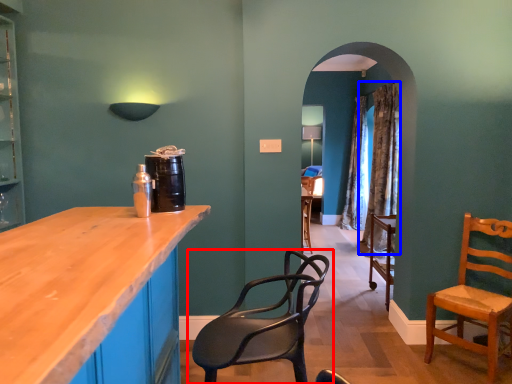
Question: Among these objects, which one is nearest to the camera, chair (highlighted by a red box) or curtain (highlighted by a blue box)?

Choices:
 (A) chair
 (B) curtain

Answer: (A)